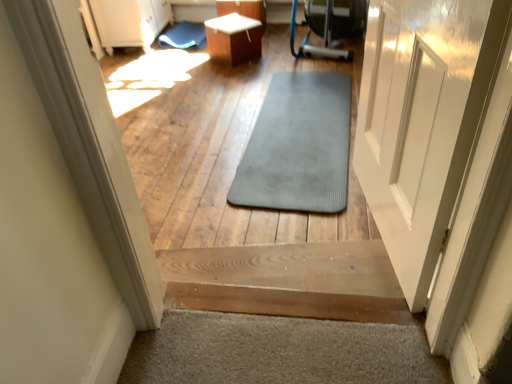
Question: Is white glossy table at center taller or shorter than gray rubber mat at center?

Choices:
 (A) tall
 (B) short

Answer: (B)

Question: Is white glossy table at center situated inside gray rubber mat at center or outside?

Choices:
 (A) outside
 (B) inside

Answer: (A)

Question: Which object is positioned closest to the wooden stairs at center?

Choices:
 (A) gray rubber mat at center, positioned as the first mat in bottom-to-top order
 (B) gray rubber mat at center
 (C) blue rubber mat at upper center, the 2th mat in the bottom-to-top sequence
 (D) white glossy table at center

Answer: (B)

Question: Which of these objects is positioned closest to the gray rubber mat at center?

Choices:
 (A) wooden stairs at center
 (B) gray rubber mat at center, which is the 2th mat in top-to-bottom order
 (C) blue rubber mat at upper center, the 2th mat in the bottom-to-top sequence
 (D) white glossy table at center

Answer: (B)